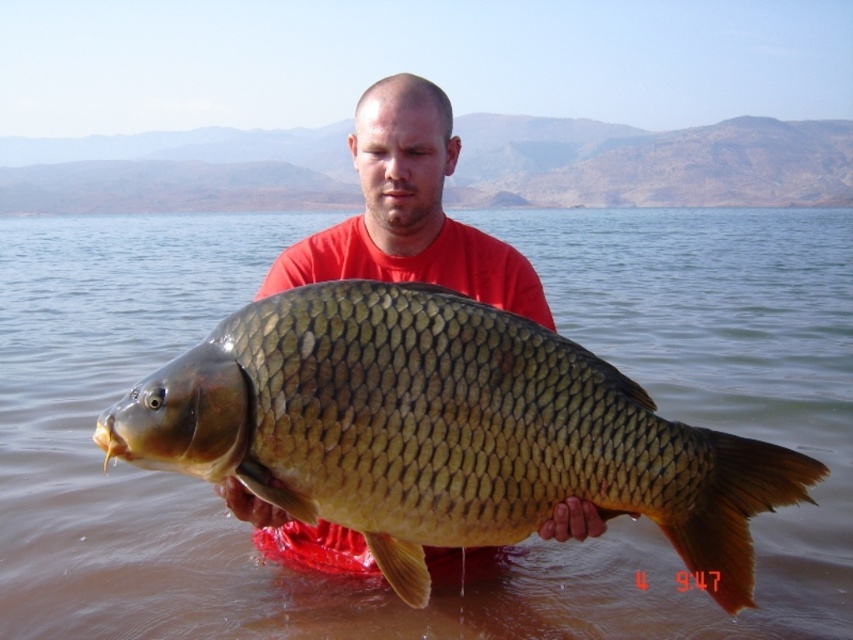
Between point (709, 476) and point (439, 115), which one is positioned behind?

Positioned behind is point (439, 115).

Where is `shiny gold scales at center`? Image resolution: width=853 pixels, height=640 pixels. shiny gold scales at center is located at coordinates (444, 432).